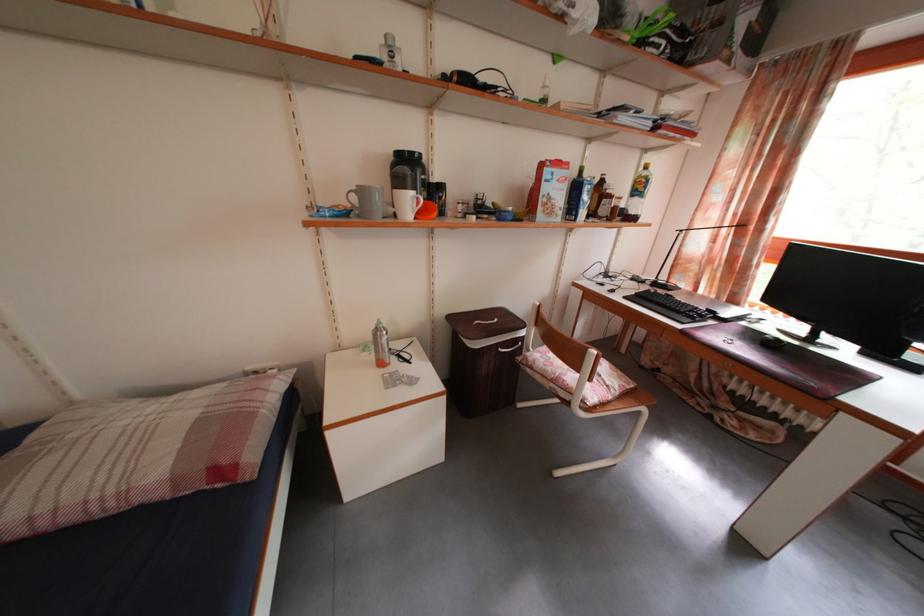
Find where to press the silver spray bottle. Please return your answer as a coordinate pair (x, y).

(381, 345)